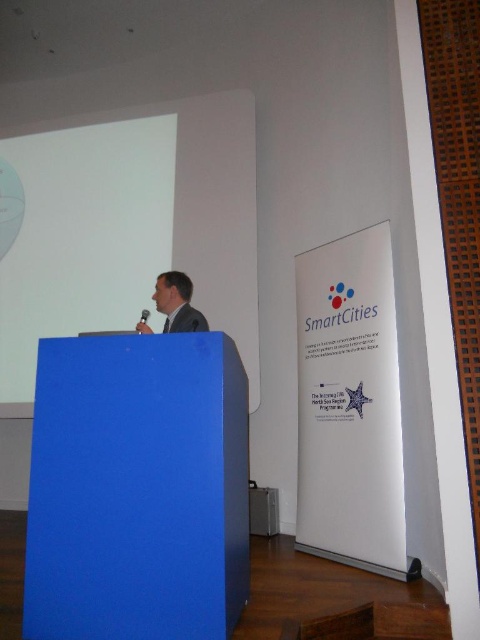
Is point (168, 285) positioned behind point (167, 332)?

Yes, it is behind point (167, 332).

Does blue suit at center appear over dark gray suit at center?

Indeed, blue suit at center is positioned over dark gray suit at center.

Is point (156, 301) positioned in front of point (189, 330)?

That is False.

The height and width of the screenshot is (640, 480). In order to click on blue suit at center in this screenshot , I will do `click(177, 304)`.

Does white matte projection screen at upper center have a lesser width compared to blue suit at center?

Incorrect, white matte projection screen at upper center's width is not less than blue suit at center's.

Locate an element on the screen. Image resolution: width=480 pixels, height=640 pixels. white matte projection screen at upper center is located at coordinates (83, 236).

Between point (168, 138) and point (170, 324), which one is positioned behind?

The point (168, 138) is behind.

The height and width of the screenshot is (640, 480). I want to click on white matte projection screen at upper center, so click(x=83, y=236).

Is point (14, 308) farther from camera compared to point (192, 326)?

That is True.

Does point (49, 323) come closer to viewer compared to point (193, 328)?

No.

Does point (64, 154) lie in front of point (204, 330)?

That is False.

Where is `white matte projection screen at upper center`? white matte projection screen at upper center is located at coordinates (83, 236).